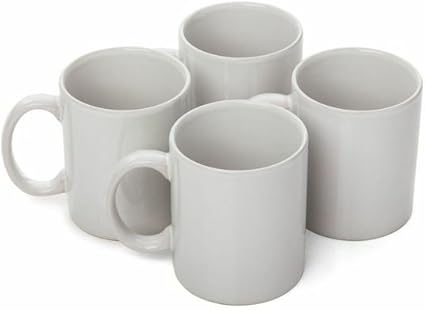
Where is `white mug`? This screenshot has height=310, width=425. white mug is located at coordinates (259, 58), (122, 102), (227, 199), (376, 119).